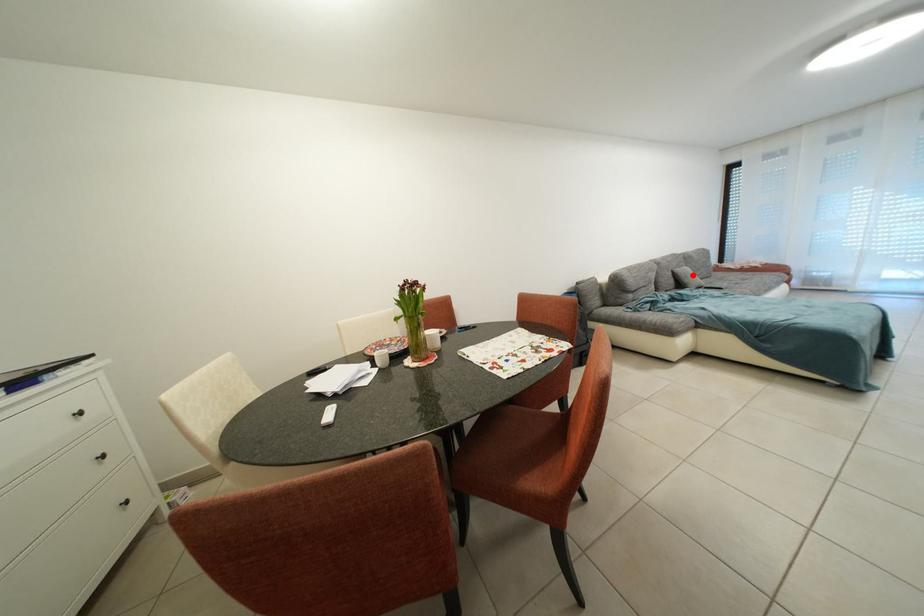
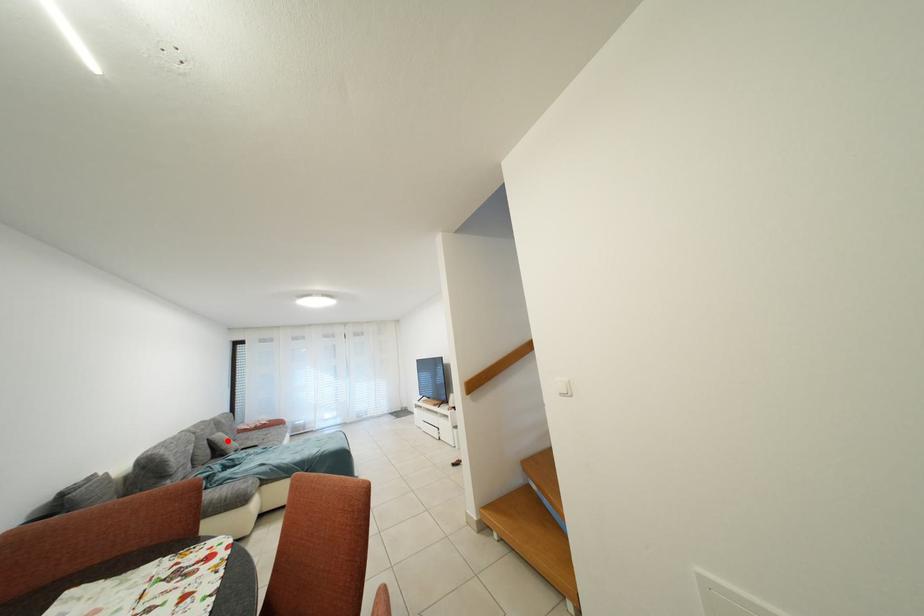
I am providing you with two images of the same scene from different viewpoints. A red point is marked on the first image and another point is marked on the second image. Do the highlighted points in image1 and image2 indicate the same real-world spot?

Yes